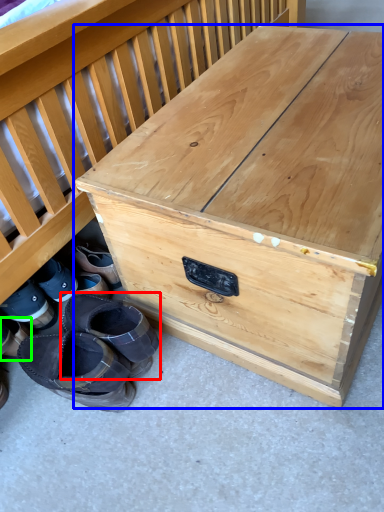
Question: Based on their relative distances, which object is farther from footwear (highlighted by a red box)? Choose from table (highlighted by a blue box) and footwear (highlighted by a green box).

Choices:
 (A) table
 (B) footwear

Answer: (A)